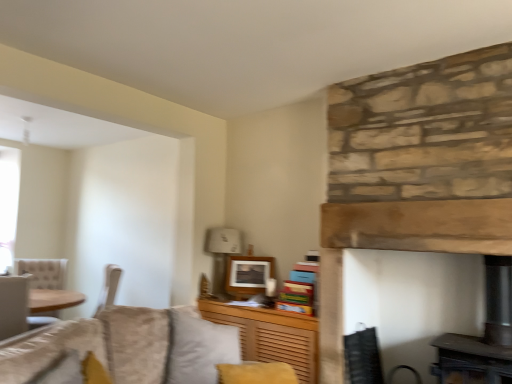
Question: From the image's perspective, is velvet gray pillow at center on top of matte white picture frame at upper center?

Choices:
 (A) no
 (B) yes

Answer: (A)

Question: Is velvet gray pillow at center bigger than matte white picture frame at upper center?

Choices:
 (A) no
 (B) yes

Answer: (B)

Question: Is matte white picture frame at upper center located within velvet gray pillow at center?

Choices:
 (A) no
 (B) yes

Answer: (A)

Question: Can you confirm if velvet gray pillow at center is taller than matte white picture frame at upper center?

Choices:
 (A) no
 (B) yes

Answer: (B)

Question: Is velvet gray pillow at center located outside matte white picture frame at upper center?

Choices:
 (A) yes
 (B) no

Answer: (A)

Question: From the image's perspective, is natural stone fireplace at center above or below white fabric lampshade at upper center?

Choices:
 (A) below
 (B) above

Answer: (A)

Question: Which is correct: natural stone fireplace at center is inside white fabric lampshade at upper center, or outside of it?

Choices:
 (A) outside
 (B) inside

Answer: (A)

Question: In terms of width, does natural stone fireplace at center look wider or thinner when compared to white fabric lampshade at upper center?

Choices:
 (A) thin
 (B) wide

Answer: (A)

Question: Considering their positions, is natural stone fireplace at center located in front of or behind white fabric lampshade at upper center?

Choices:
 (A) behind
 (B) front

Answer: (B)

Question: Is point (220, 352) positioned closer to the camera than point (231, 268)?

Choices:
 (A) farther
 (B) closer

Answer: (B)

Question: Choose the correct answer: Is velvet gray pillow at center inside matte white picture frame at upper center or outside it?

Choices:
 (A) outside
 (B) inside

Answer: (A)

Question: Is velvet gray pillow at center bigger or smaller than matte white picture frame at upper center?

Choices:
 (A) small
 (B) big

Answer: (B)

Question: From their relative heights in the image, would you say velvet gray pillow at center is taller or shorter than matte white picture frame at upper center?

Choices:
 (A) short
 (B) tall

Answer: (B)

Question: Is white fabric lampshade at upper center wider or thinner than natural stone fireplace at center?

Choices:
 (A) thin
 (B) wide

Answer: (B)

Question: Does point (223, 294) appear closer or farther from the camera than point (437, 172)?

Choices:
 (A) closer
 (B) farther

Answer: (B)